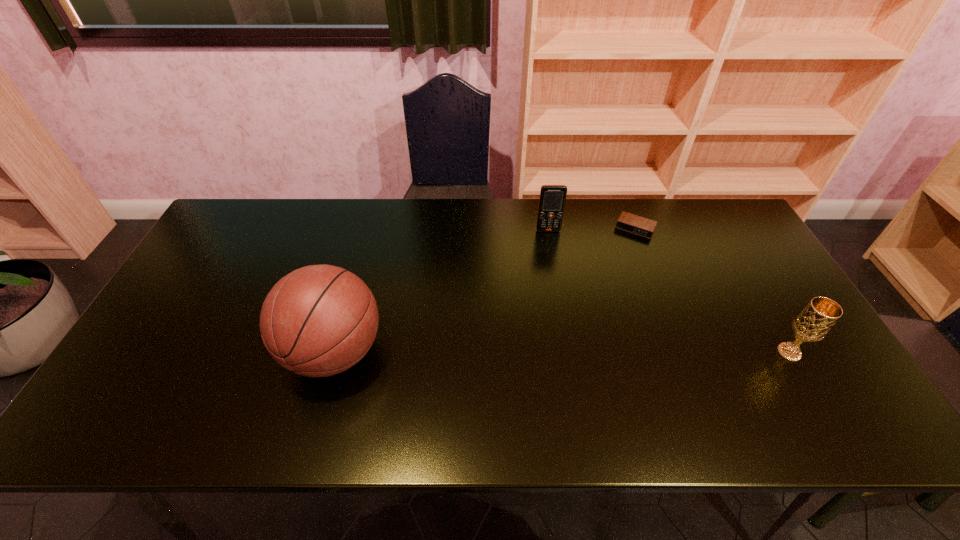
Identify the location of free space on the desktop that is between the tallest object and the rightmost object and is positioned on the screen of the cellular telephone. (566, 352).

The image size is (960, 540). What are the coordinates of `free spot on the desktop that is between the tallest object and the chalice and is positioned on the front face of the third object from left to right` in the screenshot? It's located at (574, 352).